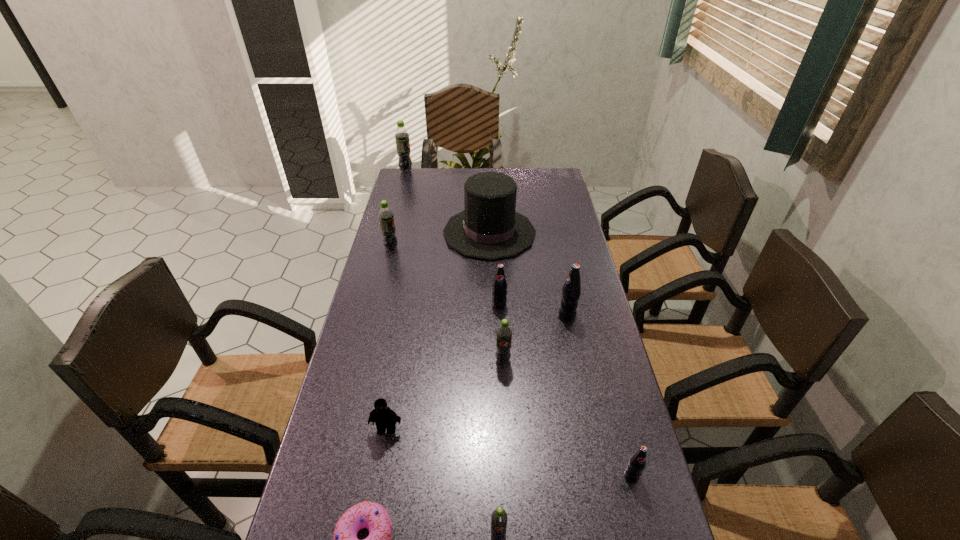
This screenshot has height=540, width=960. Identify the location of vacant space at the left edge of the desktop. (413, 197).

Find the location of `free location at the right edge of the desktop`. free location at the right edge of the desktop is located at coordinates (588, 321).

This screenshot has height=540, width=960. In the image, there is a desktop. What are the coordinates of `free space at the far left corner` in the screenshot? It's located at (426, 170).

You are a GUI agent. You are given a task and a screenshot of the screen. Output one action in this format:
    pyautogui.click(x=<x>, y=<y>)
    Task: Click on the free space at the far right corner of the desktop
    
    Given the screenshot: What is the action you would take?
    pyautogui.click(x=550, y=185)

At what (x,y) coordinates should I click in order to perform the action: click on vacant area that lies between the smallest black pop and the second smallest black pop. Please return your answer as a coordinate pair (x, y). The image size is (960, 540). Looking at the image, I should click on (565, 390).

This screenshot has height=540, width=960. What are the coordinates of `unoccupied area between the sixth farthest soda and the farthest soda` in the screenshot? It's located at (518, 323).

Where is `free space between the third farthest green soda and the rightmost black pop`? Image resolution: width=960 pixels, height=540 pixels. free space between the third farthest green soda and the rightmost black pop is located at coordinates click(567, 418).

This screenshot has height=540, width=960. In order to click on empty space between the leftmost black pop and the second farthest green soda in this screenshot , I will do `click(445, 276)`.

At what (x,y) coordinates should I click in order to perform the action: click on free area in between the fourth nearest object and the leftmost black pop. Please return your answer as a coordinate pair (x, y). Looking at the image, I should click on (443, 367).

Choose which object is the fifth nearest neighbor to the biggest black pop. Please provide its 2D coordinates. Your answer should be formatted as a tuple, i.e. [(x, y)], where the tuple contains the x and y coordinates of a point satisfying the conditions above.

[(385, 418)]